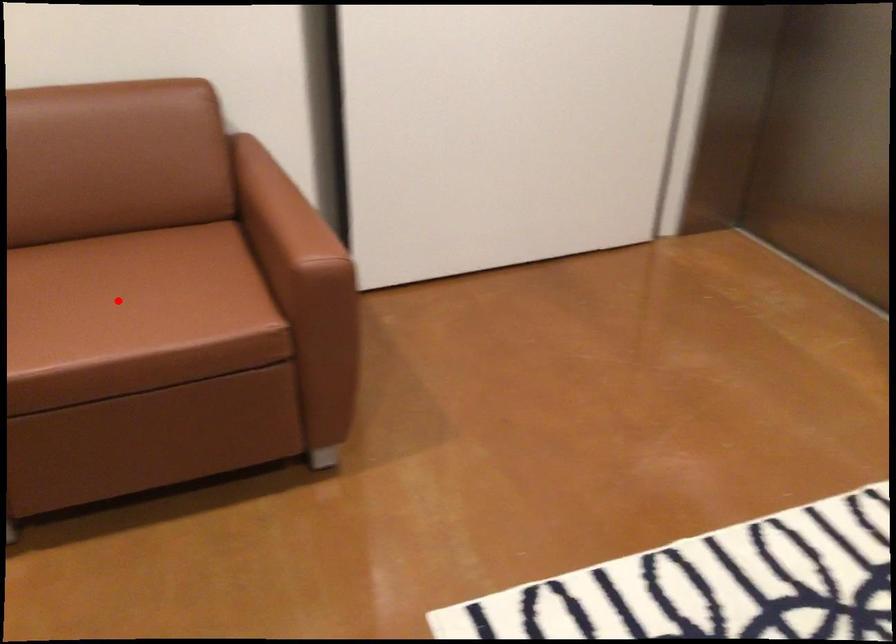
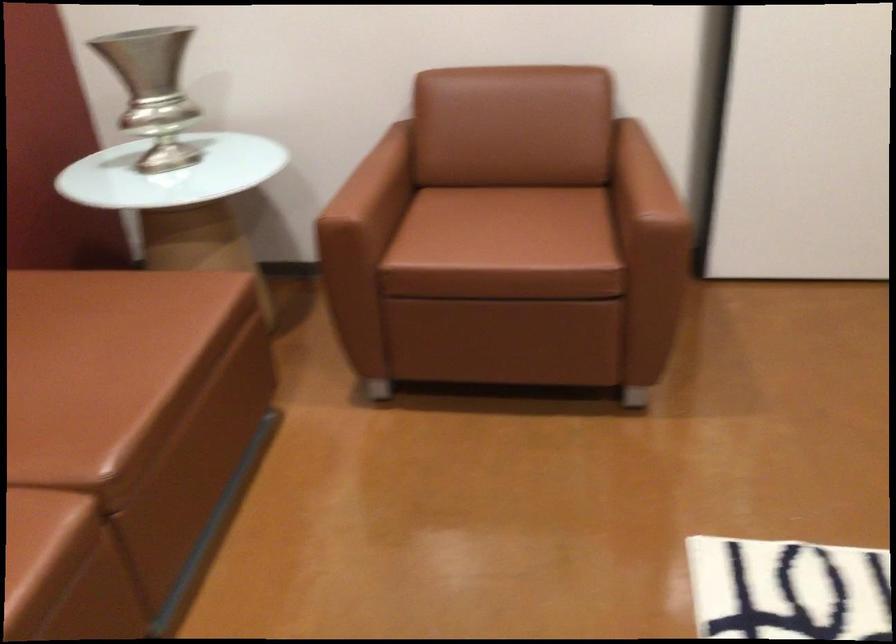
Question: I am providing you with two images of the same scene from different viewpoints. Image1 has a red point marked. In image2, the corresponding 3D location appears at what relative position? Reply with the corresponding letter.

Choices:
 (A) Closer
 (B) Farther

Answer: (B)